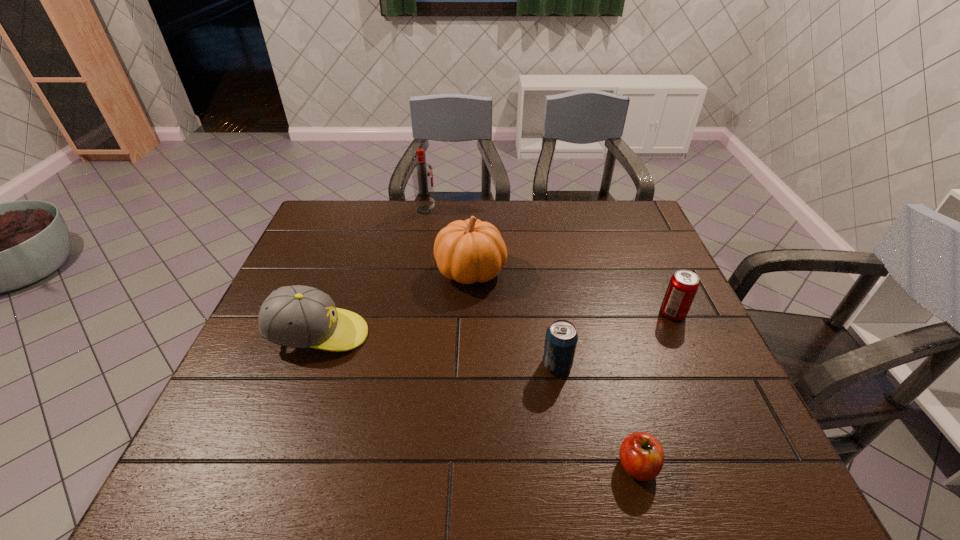
Where is `free space that satisfies the following two spatial constraints: 1. on the front label of the farthest object; 2. on the back side of the right pop soda`? free space that satisfies the following two spatial constraints: 1. on the front label of the farthest object; 2. on the back side of the right pop soda is located at coordinates (408, 313).

Identify the location of free spot that satisfies the following two spatial constraints: 1. on the front label of the farther pop soda; 2. on the left side of the fifth object from right to left. The width and height of the screenshot is (960, 540). (408, 313).

The image size is (960, 540). In order to click on free spot that satisfies the following two spatial constraints: 1. on the front label of the vodka; 2. on the left side of the rightmost object in this screenshot , I will do `click(408, 313)`.

The image size is (960, 540). In order to click on vacant point that satisfies the following two spatial constraints: 1. on the front side of the fourth object from left to right; 2. on the right side of the apple in this screenshot , I will do `click(573, 465)`.

Where is `free space that satisfies the following two spatial constraints: 1. on the front label of the second farthest object; 2. on the right side of the tallest object`? free space that satisfies the following two spatial constraints: 1. on the front label of the second farthest object; 2. on the right side of the tallest object is located at coordinates (415, 272).